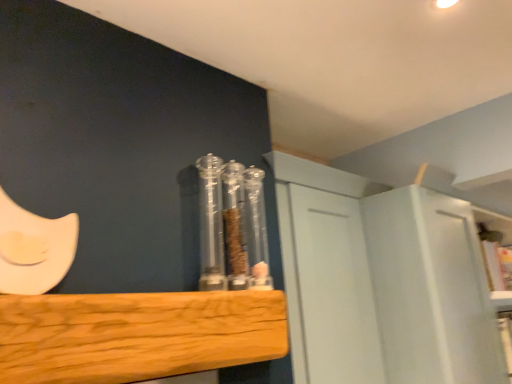
Question: Is transparent plastic containers at center next to natural wood plank at center and touching it?

Choices:
 (A) no
 (B) yes

Answer: (A)

Question: From the image's perspective, is transparent plastic containers at center on top of natural wood plank at center?

Choices:
 (A) yes
 (B) no

Answer: (A)

Question: Considering the relative sizes of transparent plastic containers at center and natural wood plank at center in the image provided, is transparent plastic containers at center shorter than natural wood plank at center?

Choices:
 (A) no
 (B) yes

Answer: (A)

Question: Is natural wood plank at center at the back of transparent plastic containers at center?

Choices:
 (A) yes
 (B) no

Answer: (B)

Question: Considering the relative sizes of transparent plastic containers at center and natural wood plank at center in the image provided, is transparent plastic containers at center wider than natural wood plank at center?

Choices:
 (A) no
 (B) yes

Answer: (A)

Question: Considering the positions of natural wood plank at center and transparent plastic containers at center in the image, is natural wood plank at center bigger or smaller than transparent plastic containers at center?

Choices:
 (A) big
 (B) small

Answer: (A)

Question: Does point (104, 355) appear closer or farther from the camera than point (210, 216)?

Choices:
 (A) closer
 (B) farther

Answer: (A)

Question: From the image's perspective, is natural wood plank at center positioned above or below transparent plastic containers at center?

Choices:
 (A) below
 (B) above

Answer: (A)

Question: Is natural wood plank at center to the left or to the right of transparent plastic containers at center in the image?

Choices:
 (A) left
 (B) right

Answer: (A)

Question: Is natural wood plank at center situated inside white matte cabinet at upper right or outside?

Choices:
 (A) outside
 (B) inside

Answer: (A)

Question: Is point (181, 347) closer or farther from the camera than point (440, 331)?

Choices:
 (A) farther
 (B) closer

Answer: (B)

Question: From a real-world perspective, is natural wood plank at center positioned above or below white matte cabinet at upper right?

Choices:
 (A) above
 (B) below

Answer: (A)

Question: From the image's perspective, relative to white matte cabinet at upper right, is natural wood plank at center above or below?

Choices:
 (A) above
 (B) below

Answer: (A)

Question: Is transparent plastic containers at center spatially inside natural wood plank at center, or outside of it?

Choices:
 (A) inside
 (B) outside

Answer: (B)

Question: From the image's perspective, is transparent plastic containers at center located above or below natural wood plank at center?

Choices:
 (A) below
 (B) above

Answer: (B)